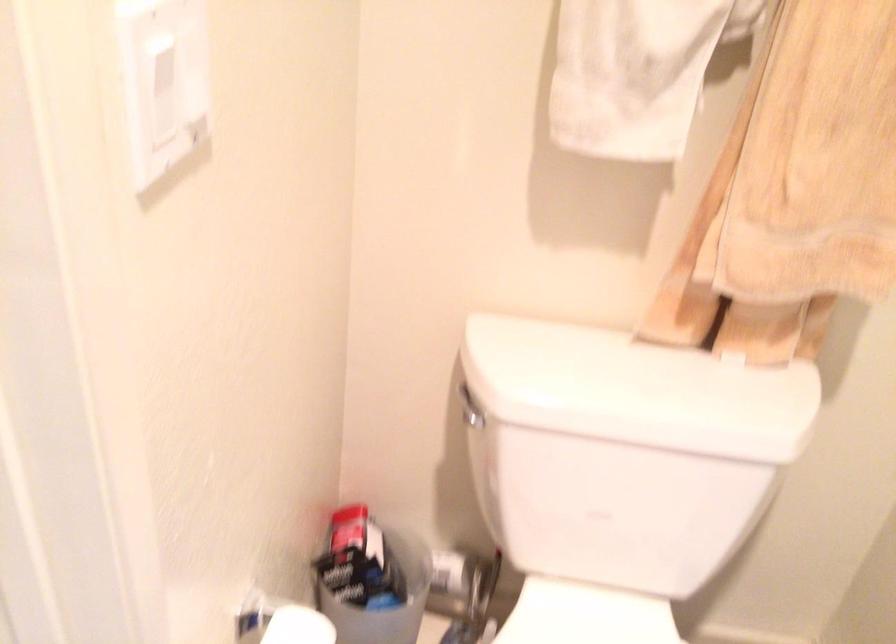
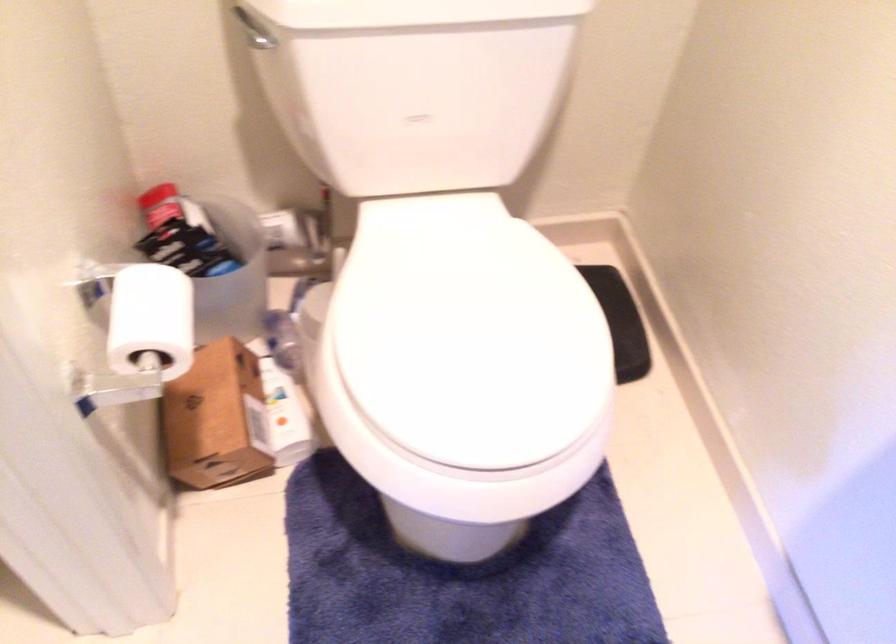
Where in the second image is the point corresponding to (x=467, y=389) from the first image?

(247, 20)